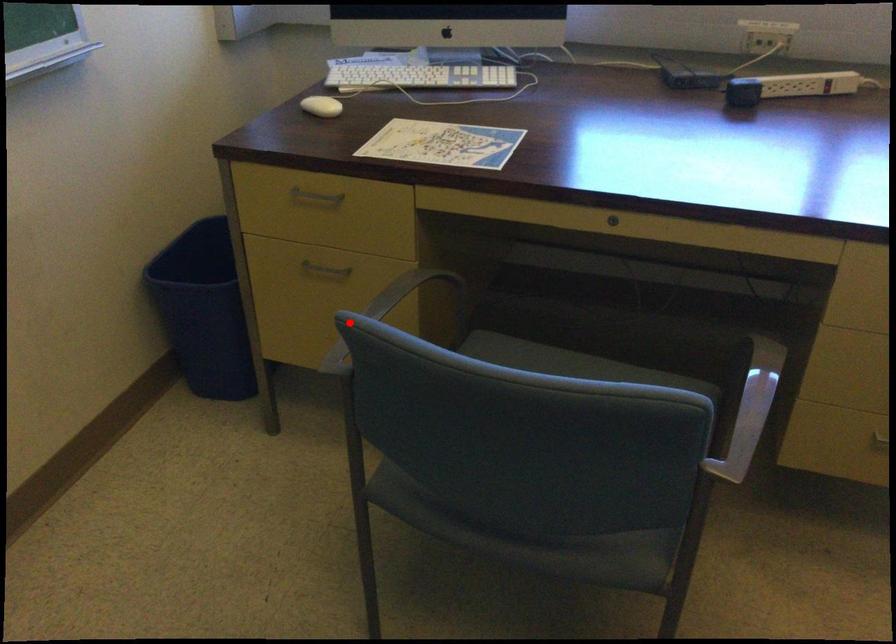
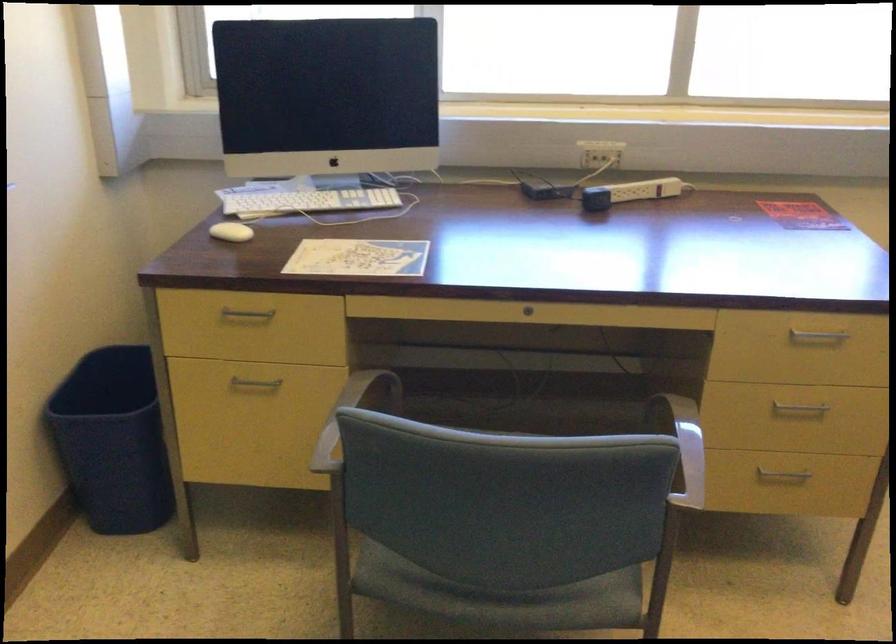
Question: I am providing you with two images of the same scene from different viewpoints. In image1, a red point is highlighted. Considering the same 3D point in image2, which of the following is correct?

Choices:
 (A) It is closer
 (B) It is farther

Answer: (B)